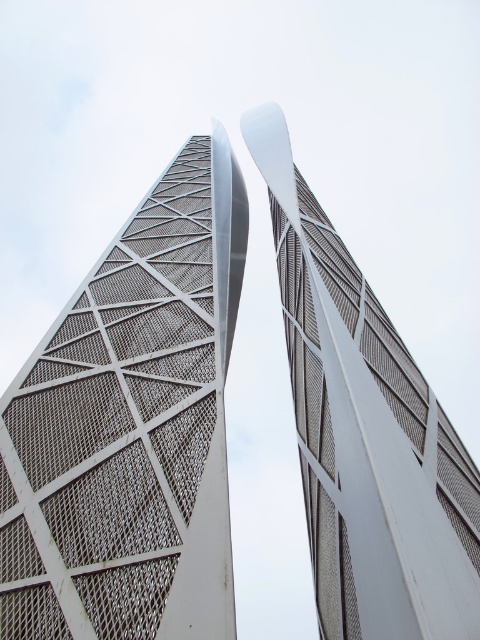
Between white mesh tower at center and white mesh tower at upper center, which one appears on the right side from the viewer's perspective?

Positioned to the right is white mesh tower at upper center.

Which is in front, point (88, 464) or point (314, 385)?

Point (88, 464) is more forward.

Find the location of `white mesh tower at center`. white mesh tower at center is located at coordinates (131, 428).